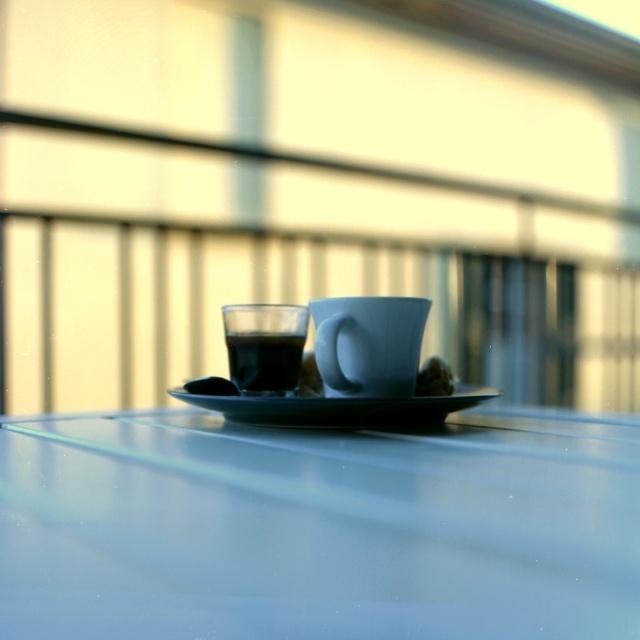
You are setting up a tea set on the light blue table. You have a matte ceramic cup at center and a black glossy saucer at center. Which item should you place first to ensure proper fitting?

The matte ceramic cup at center is smaller than the black glossy saucer at center, so you should place the black glossy saucer at center first to ensure it can accommodate the cup properly.

You are taking a photo of the table and its items. You want to focus on the object at point (157, 620) and ensure that the object at point (308, 420) is also in focus. Given the shallow depth of field, will both points be in focus if you focus on the first point?

Point (157, 620) is closer to the camera than point (308, 420). Since the depth of field is shallow, focusing on the closer point may not keep the farther point in focus. Adjust your focus or aperture to ensure both are sharp.

You have a small decorative item that is 10 cm wide. You want to place it on the glossy glass table at center without overlapping the black glossy saucer at center. Is there enough space?

The glossy glass table at center might be wider than the black glossy saucer at center, so there could be enough space to place the 10 cm wide decorative item without overlapping. However, the exact dimensions are uncertain based on the provided description.